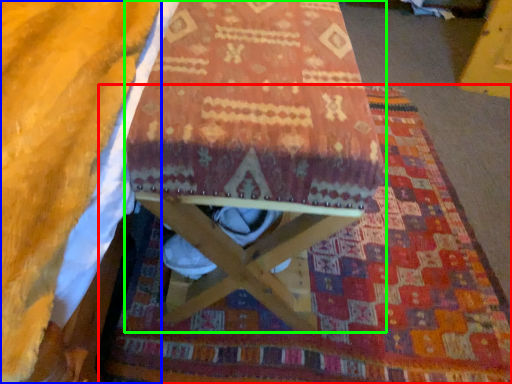
Question: Which is farther away from mat (highlighted by a red box)? blanket (highlighted by a blue box) or furniture (highlighted by a green box)?

Choices:
 (A) blanket
 (B) furniture

Answer: (A)